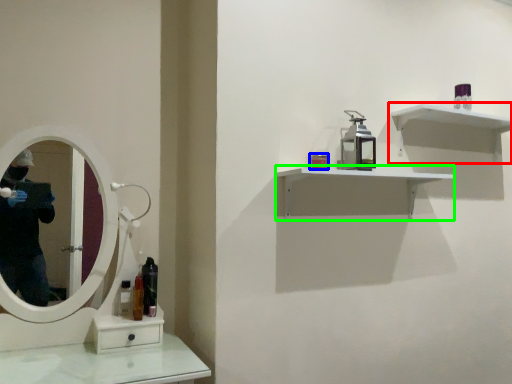
Question: Which object is the closest to the shelf (highlighted by a red box)? Choose among these: toiletry (highlighted by a blue box) or shelf (highlighted by a green box).

Choices:
 (A) toiletry
 (B) shelf

Answer: (B)